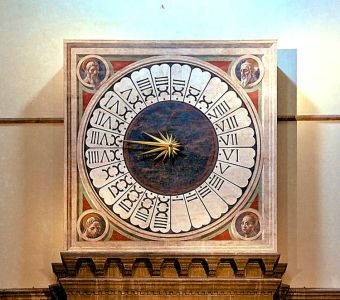
The width and height of the screenshot is (340, 300). Find the location of `black mark on the wall`. black mark on the wall is located at coordinates (161, 3).